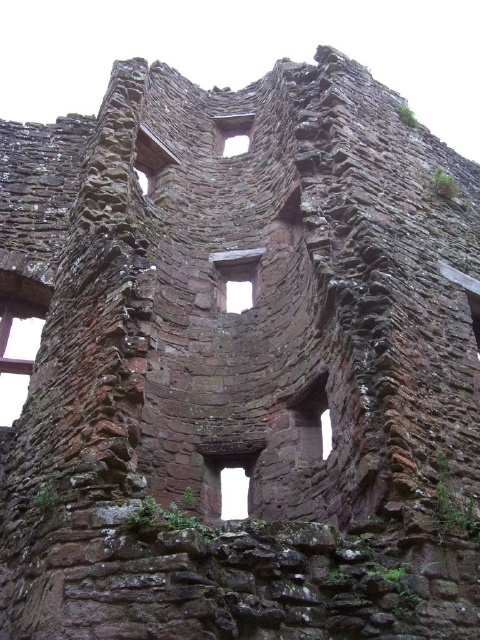
Consider the image. You are an archaeologist examining the ruins. You have a measuring tape and notice two windows in the stone wall. The brown stone window at left and the transparent stone window at center. Which window has a wider opening?

The transparent stone window at center has a wider opening than the brown stone window at left.

You are standing at the center of the ruins and want to locate the brown stone window at left. Based on its coordinates, in which direction should you look to find it?

The brown stone window at left is located at coordinates point [20,333], which means it is positioned to the left side of the structure. Therefore, you should look to your left to find it.